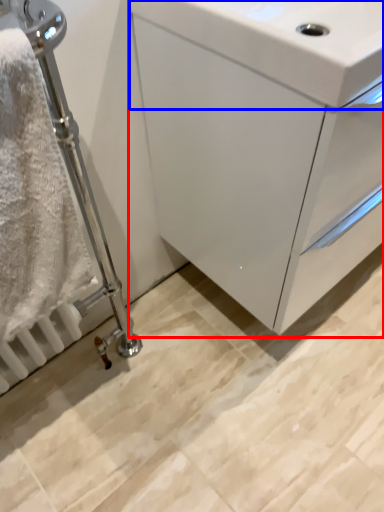
Question: Which of the following is the farthest to the observer, bathroom cabinet (highlighted by a red box) or sink (highlighted by a blue box)?

Choices:
 (A) bathroom cabinet
 (B) sink

Answer: (A)